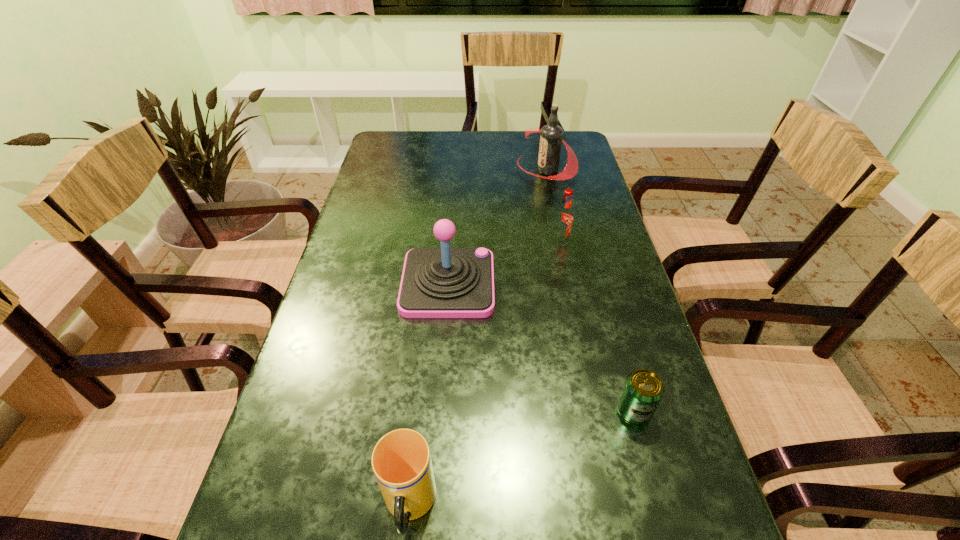
The height and width of the screenshot is (540, 960). What are the coordinates of `the farthest object` in the screenshot? It's located at (551, 138).

This screenshot has height=540, width=960. Find the location of `the taller root beer`. the taller root beer is located at coordinates (551, 138).

The height and width of the screenshot is (540, 960). Find the location of `the third farthest object`. the third farthest object is located at coordinates (445, 282).

Where is `joystick`? Image resolution: width=960 pixels, height=540 pixels. joystick is located at coordinates (445, 282).

Locate an element on the screen. the shorter root beer is located at coordinates (564, 219).

Locate an element on the screen. the nearer root beer is located at coordinates (564, 219).

Where is `the shortest object`? the shortest object is located at coordinates (643, 390).

Where is `the fourth farthest object`? the fourth farthest object is located at coordinates [x=643, y=390].

You are a GUI agent. You are given a task and a screenshot of the screen. Output one action in this format:
    pyautogui.click(x=<x>, y=<y>)
    Task: Click on the free space located 0.060m on the label of the farther root beer
    
    Given the screenshot: What is the action you would take?
    coord(499,170)

Identify the location of vacant area situated on the label of the farther root beer. Image resolution: width=960 pixels, height=540 pixels. (491, 170).